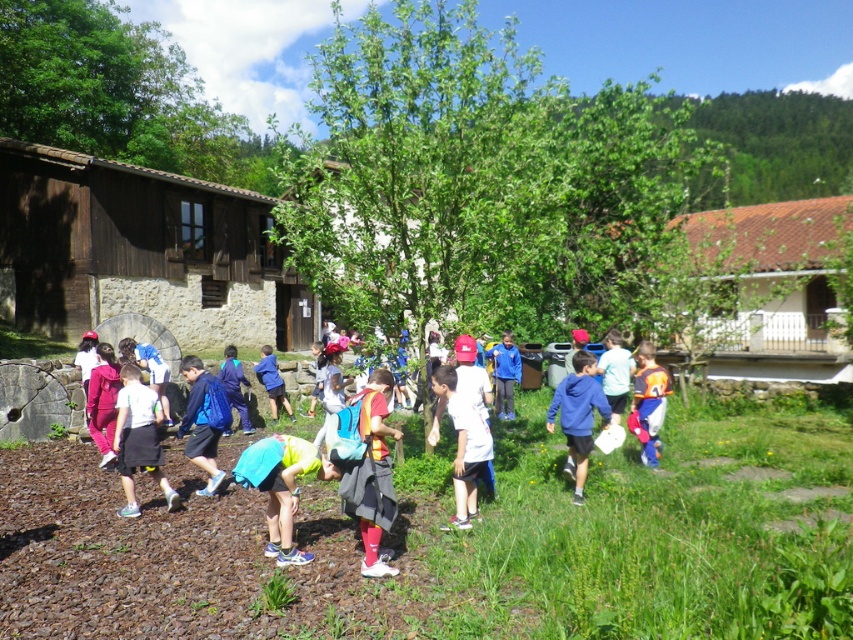
You are a photographer trying to capture a photo of the white matte shirt at center and the orange fabric backpack at right. Based on their positions, which object should you focus on first to ensure both are in clear view?

The white matte shirt at center is shorter than the orange fabric backpack at right, so you should focus on the orange fabric backpack at right first to ensure both are in clear view.

You are a photographer positioned at the origin of the coordinate system. You want to capture a photo of the light blue fabric at center located at point [281,486]. What is the direction you should aim your camera to capture the light blue fabric at center in the frame?

The light blue fabric at center is located at point [281,486]. To capture it, aim your camera towards that coordinate.